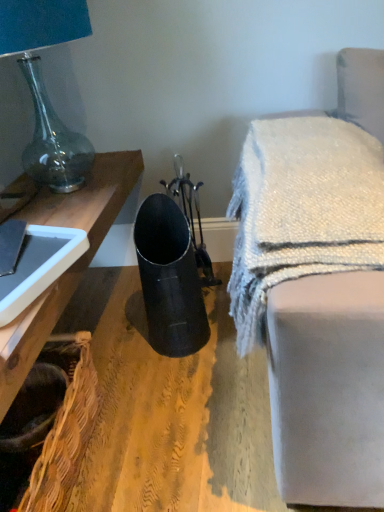
Question: Considering the relative sizes of woven brown basket at lower left and teal glass lamp at upper left in the image provided, is woven brown basket at lower left thinner than teal glass lamp at upper left?

Choices:
 (A) yes
 (B) no

Answer: (A)

Question: Is woven brown basket at lower left far away from teal glass lamp at upper left?

Choices:
 (A) no
 (B) yes

Answer: (A)

Question: From the image's perspective, is woven brown basket at lower left located beneath teal glass lamp at upper left?

Choices:
 (A) yes
 (B) no

Answer: (A)

Question: Considering the relative sizes of woven brown basket at lower left and teal glass lamp at upper left in the image provided, is woven brown basket at lower left bigger than teal glass lamp at upper left?

Choices:
 (A) no
 (B) yes

Answer: (A)

Question: Considering the relative sizes of woven brown basket at lower left and teal glass lamp at upper left in the image provided, is woven brown basket at lower left smaller than teal glass lamp at upper left?

Choices:
 (A) yes
 (B) no

Answer: (A)

Question: Is woven brown basket at lower left shorter than teal glass lamp at upper left?

Choices:
 (A) no
 (B) yes

Answer: (B)

Question: Is woven brown basket at lower left facing away from white textured blanket at upper right?

Choices:
 (A) no
 (B) yes

Answer: (A)

Question: From the image's perspective, is woven brown basket at lower left located above white textured blanket at upper right?

Choices:
 (A) yes
 (B) no

Answer: (B)

Question: Are woven brown basket at lower left and white textured blanket at upper right far apart?

Choices:
 (A) yes
 (B) no

Answer: (B)

Question: Is woven brown basket at lower left taller than white textured blanket at upper right?

Choices:
 (A) yes
 (B) no

Answer: (B)

Question: Can you confirm if woven brown basket at lower left is positioned to the right of white textured blanket at upper right?

Choices:
 (A) yes
 (B) no

Answer: (B)

Question: Can we say woven brown basket at lower left lies outside white textured blanket at upper right?

Choices:
 (A) yes
 (B) no

Answer: (A)

Question: Is white textured blanket at upper right oriented away from teal glass lamp at upper left?

Choices:
 (A) no
 (B) yes

Answer: (A)